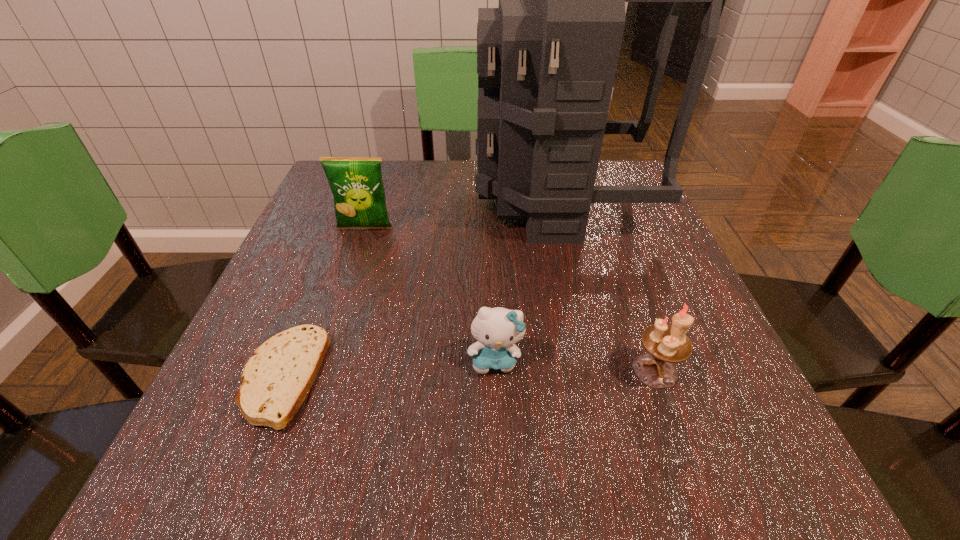
Find the location of `vacant space at the far edge`. vacant space at the far edge is located at coordinates (391, 193).

Find the location of `vacant space at the left edge of the desktop`. vacant space at the left edge of the desktop is located at coordinates (215, 398).

This screenshot has height=540, width=960. I want to click on vacant space at the right edge, so click(x=599, y=259).

Find the location of a particular element. vacant space at the far right corner of the desktop is located at coordinates (605, 182).

Identify the location of free space between the third tallest object and the pita bread. click(x=468, y=374).

The image size is (960, 540). I want to click on free space between the candle holder and the backpack, so click(x=608, y=286).

Find the location of a particular element. empty space that is in between the pita bread and the backpack is located at coordinates pyautogui.click(x=420, y=289).

This screenshot has width=960, height=540. Identify the location of free space that is in between the shortest object and the second shortest object. tap(389, 369).

Find the location of a particular element. The image size is (960, 540). vacant space in between the third tallest object and the tallest object is located at coordinates (608, 286).

Identify the location of free space between the shortest object and the kitten. (389, 369).